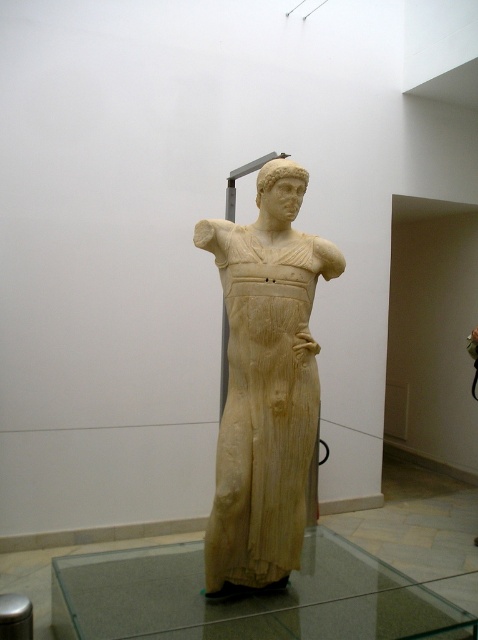
Which is behind, point (201, 246) or point (304, 536)?

Positioned behind is point (304, 536).

Based on the photo, is beige marble statue at center above transparent glass table at center?

Yes, beige marble statue at center is above transparent glass table at center.

Between point (226, 467) and point (413, 602), which one is positioned in front?

Point (226, 467) is in front.

Image resolution: width=478 pixels, height=640 pixels. In order to click on beige marble statue at center in this screenshot , I will do `click(265, 385)`.